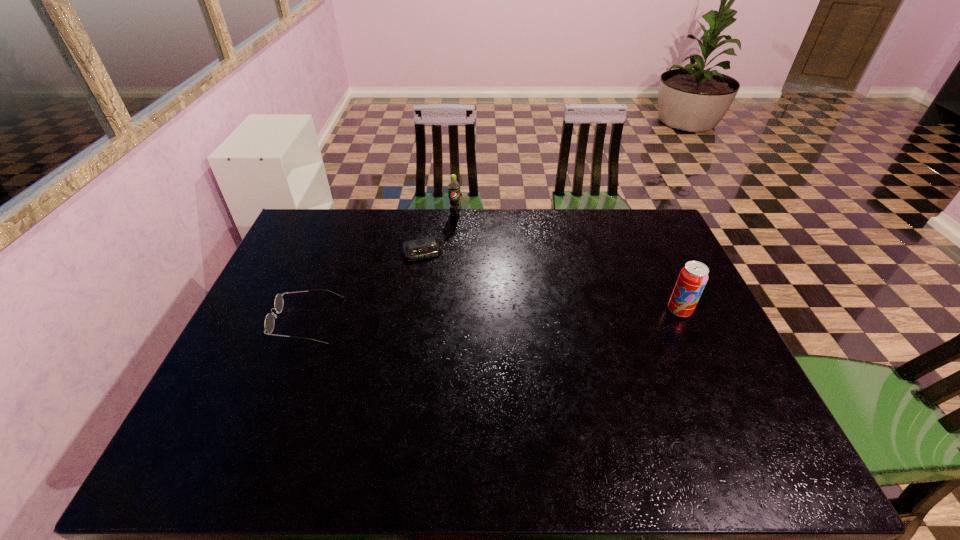
Image resolution: width=960 pixels, height=540 pixels. Find the location of `spectacles`. spectacles is located at coordinates (269, 323).

You are a GUI agent. You are given a task and a screenshot of the screen. Output one action in this format:
    pyautogui.click(x=<x>, y=<y>)
    Task: Click on the second shortest object
    Image resolution: width=960 pixels, height=540 pixels.
    Given the screenshot: What is the action you would take?
    pyautogui.click(x=269, y=323)

Image resolution: width=960 pixels, height=540 pixels. Find the location of `the right soda`. the right soda is located at coordinates (693, 277).

Where is `the rightmost object`? This screenshot has width=960, height=540. the rightmost object is located at coordinates (693, 277).

Image resolution: width=960 pixels, height=540 pixels. What are the coordinates of `alarm clock` in the screenshot? It's located at (423, 248).

Identify the location of the third object from right to left. (423, 248).

The image size is (960, 540). I want to click on the third object from left to right, so click(453, 187).

Locate an element on the screen. the farther soda is located at coordinates pyautogui.click(x=453, y=187).

Find the location of a particular element. The height and width of the screenshot is (540, 960). blank area located 0.290m on the left of the rightmost object is located at coordinates (564, 310).

You are a GUI agent. You are given a task and a screenshot of the screen. Output one action in this format:
    pyautogui.click(x=<x>, y=<y>)
    Task: Click on the free location located on the display of the third object from right to left
    The width and height of the screenshot is (960, 540).
    Given the screenshot: What is the action you would take?
    pyautogui.click(x=455, y=354)